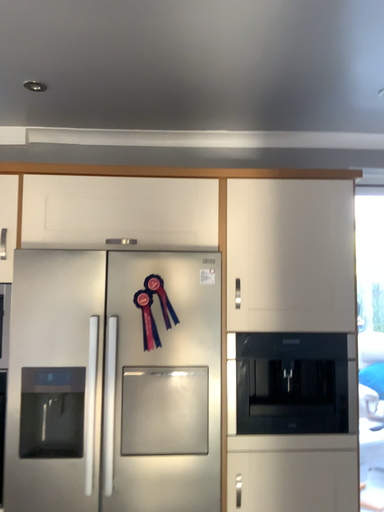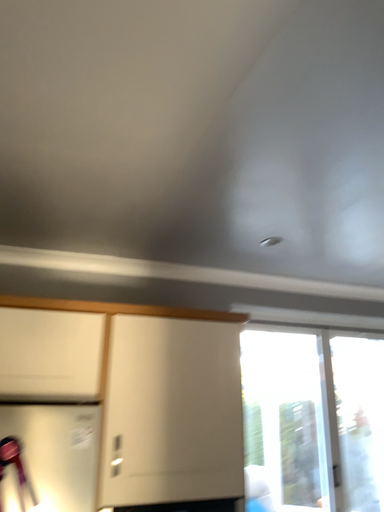
Question: How did the camera likely rotate when shooting the video?

Choices:
 (A) rotated left
 (B) rotated right

Answer: (B)